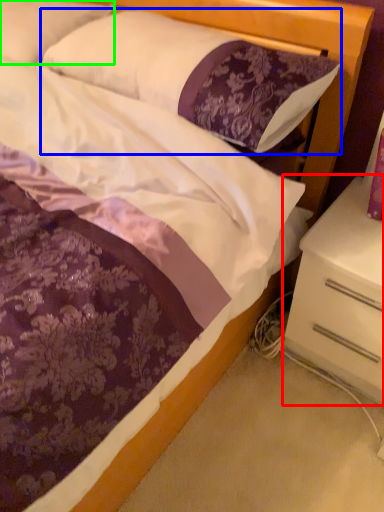
Question: Which object is positioned closest to nightstand (highlighted by a red box)? Select from pillow (highlighted by a blue box) and pillow (highlighted by a green box).

Choices:
 (A) pillow
 (B) pillow

Answer: (A)